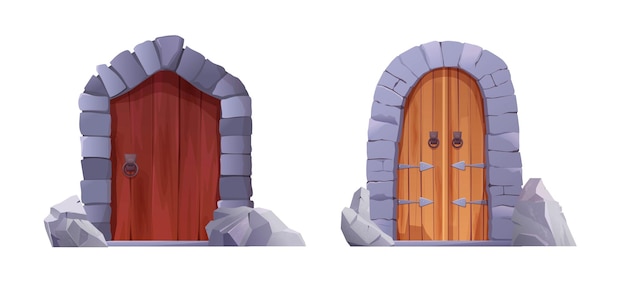
Identify the location of boards on door. [121, 113], [140, 121], [166, 131], [188, 135], [210, 144].